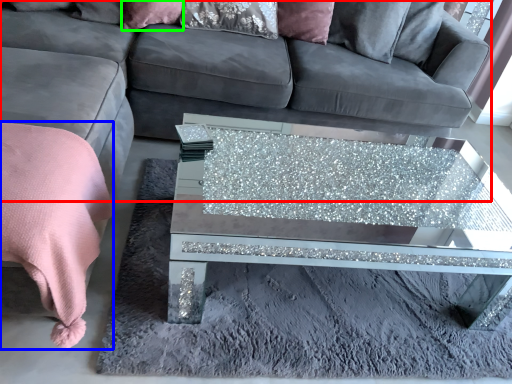
Question: Considering the real-world distances, which object is farthest from studio couch (highlighted by a red box)? blanket (highlighted by a blue box) or pillow (highlighted by a green box)?

Choices:
 (A) blanket
 (B) pillow

Answer: (A)